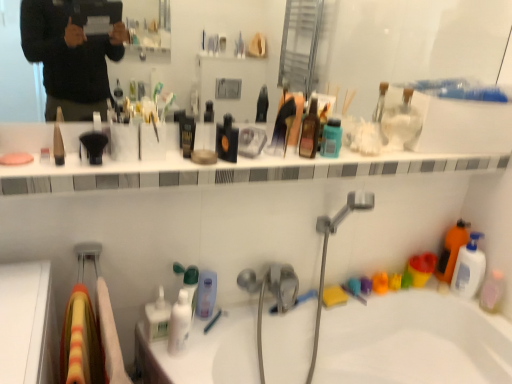
At what (x,y) coordinates should I click in order to perform the action: click on shiny brown bottle at center, acting as the 1th cleaning product starting from the top. Please return your answer as a coordinate pair (x, y). Looking at the image, I should click on (309, 131).

At what (x,y) coordinates should I click in order to perform the action: click on white glossy jar at upper center, placed as the 1th toiletry when sorted from top to bottom. Please return your answer as a coordinate pair (x, y). The height and width of the screenshot is (384, 512). Looking at the image, I should click on (400, 118).

You are a GUI agent. You are given a task and a screenshot of the screen. Output one action in this format:
    pyautogui.click(x=<x>, y=<y>)
    Task: Click on the black glass bottle at center, the 5th toiletry from the left
    
    Given the screenshot: What is the action you would take?
    pyautogui.click(x=227, y=140)

This screenshot has width=512, height=384. What do you see at coordinates (469, 268) in the screenshot? I see `white plastic mouthwash at right, arranged as the 1th mouthwash when viewed from the back` at bounding box center [469, 268].

At what (x,y) coordinates should I click in order to perform the action: click on matte black pencil at upper left, the 6th toiletry viewed from the right. Please return your answer as a coordinate pair (x, y). This screenshot has width=512, height=384. Looking at the image, I should click on (58, 140).

What do you see at coordinates (58, 140) in the screenshot?
I see `matte black pencil at upper left, marked as the 4th toiletry in a bottom-to-top arrangement` at bounding box center [58, 140].

In order to face transparent glass mirror at upper center, should I rotate leftwards or rightwards?

Turn right by 6.823 degrees to look at transparent glass mirror at upper center.

Locate an element on the screen. This screenshot has height=384, width=512. shiny brown bottle at center, which is the second cleaning product from left to right is located at coordinates (309, 131).

Does point (154, 325) lie behind point (59, 144)?

Yes, point (154, 325) is farther from viewer.

Could you tell me if white glossy pump bottle at lower center, marked as the fifth toiletry in a top-to-bottom arrangement, is turned towards matte black pencil at upper left, marked as the 4th toiletry in a bottom-to-top arrangement?

No.

Which of these two, white glossy pump bottle at lower center, the second toiletry when ordered from bottom to top, or matte black pencil at upper left, the 3th toiletry positioned from the top, is smaller?

Smaller between the two is matte black pencil at upper left, the 3th toiletry positioned from the top.

Which is more to the left, white glossy pump bottle at lower center, marked as the fifth toiletry in a top-to-bottom arrangement, or matte black pencil at upper left, the 6th toiletry viewed from the right?

From the viewer's perspective, matte black pencil at upper left, the 6th toiletry viewed from the right, appears more on the left side.

Could you tell me if black glass bottle at center, which ranks as the 2th toiletry in top-to-bottom order, is turned towards white glossy bottle at center, which is the 1th cleaning product from bottom to top?

No, black glass bottle at center, which ranks as the 2th toiletry in top-to-bottom order, is not aimed at white glossy bottle at center, which is the 1th cleaning product from bottom to top.

Which object is further away from the camera taking this photo, black glass bottle at center, which ranks as the 2th toiletry in top-to-bottom order, or white glossy bottle at center, marked as the second cleaning product in a front-to-back arrangement?

white glossy bottle at center, marked as the second cleaning product in a front-to-back arrangement, is more distant.

From a real-world perspective, is black glass bottle at center, the 5th toiletry from the left, under white glossy bottle at center, the third cleaning product when ordered from top to bottom?

No.

From the black glass bottle at center, which appears as the 2th toiletry when viewed from the right, count 2nd cleaning products backward and point to it. Please provide its 2D coordinates.

[(189, 282)]

Is white glossy pump bottle at lower center, which is the fifth toiletry from right to left, closer to the viewer compared to black glass bottle at center, the 5th toiletry from the left?

That is False.

From a real-world perspective, starting from the white glossy pump bottle at lower center, the second toiletry when ordered from bottom to top, which toiletry is the 4th one vertically above it? Please provide its 2D coordinates.

[(227, 140)]

Is white glossy pump bottle at lower center, marked as the fifth toiletry in a top-to-bottom arrangement, at the left side of black glass bottle at center, which ranks as the 5th toiletry in bottom-to-top order?

Yes.

Measure the distance from white glossy pump bottle at lower center, marked as the fifth toiletry in a top-to-bottom arrangement, to black glass bottle at center, which ranks as the 5th toiletry in bottom-to-top order.

The distance of white glossy pump bottle at lower center, marked as the fifth toiletry in a top-to-bottom arrangement, from black glass bottle at center, which ranks as the 5th toiletry in bottom-to-top order, is 21.16 inches.

Is transparent glass mirror at upper center located outside white glossy jar at upper center, placed as the 1th toiletry when sorted from top to bottom?

Yes, transparent glass mirror at upper center is outside of white glossy jar at upper center, placed as the 1th toiletry when sorted from top to bottom.

From the image's perspective, would you say transparent glass mirror at upper center is positioned over white glossy jar at upper center, which appears as the 1th toiletry when viewed from the right?

Correct, transparent glass mirror at upper center appears higher than white glossy jar at upper center, which appears as the 1th toiletry when viewed from the right, in the image.

Is transparent glass mirror at upper center shorter than white glossy jar at upper center, which ranks as the 6th toiletry in bottom-to-top order?

Incorrect, the height of transparent glass mirror at upper center does not fall short of that of white glossy jar at upper center, which ranks as the 6th toiletry in bottom-to-top order.

Does point (441, 43) appear closer or farther from the camera than point (403, 147)?

Point (441, 43) is farther from the camera than point (403, 147).

Considering the points (181, 269) and (437, 266), which point is in front, point (181, 269) or point (437, 266)?

Positioned in front is point (181, 269).

From the image's perspective, which object appears higher, white glossy bottle at center, which is the 1th cleaning product from bottom to top, or orange matte bottle at right, arranged as the second cleaning product when ordered from the bottom?

orange matte bottle at right, arranged as the second cleaning product when ordered from the bottom, from the image's perspective.

In the image, there is a orange matte bottle at right, the 3th cleaning product positioned from the left. In order to click on cleaning product below it (from the image's perspective) in this screenshot , I will do `click(189, 282)`.

Is white glossy bottle at center, the third cleaning product when ordered from top to bottom, surrounding orange matte bottle at right, placed as the 3th cleaning product when sorted from front to back?

No, orange matte bottle at right, placed as the 3th cleaning product when sorted from front to back, is not a part of white glossy bottle at center, the third cleaning product when ordered from top to bottom.

Consider the image. What's the angular difference between matte black pencil at upper left, which is counted as the 1th toiletry, starting from the left, and white plastic mouthwash at right, the 2th mouthwash in the top-to-bottom sequence,'s facing directions?

There is a 83.1-degree angle between the facing directions of matte black pencil at upper left, which is counted as the 1th toiletry, starting from the left, and white plastic mouthwash at right, the 2th mouthwash in the top-to-bottom sequence.

Visually, is matte black pencil at upper left, the 6th toiletry viewed from the right, positioned to the left or to the right of white plastic mouthwash at right, which is the second mouthwash from left to right?

In the image, matte black pencil at upper left, the 6th toiletry viewed from the right, appears on the left side of white plastic mouthwash at right, which is the second mouthwash from left to right.

Which point is more forward, (57, 163) or (472, 237)?

Point (57, 163)

Do you think white glossy bottle at center, marked as the second cleaning product in a front-to-back arrangement, is within white plastic mouthwash at right, arranged as the 1th mouthwash when viewed from the back, or outside of it?

The correct answer is: outside.

From a real-world perspective, is white glossy bottle at center, the third cleaning product when ordered from top to bottom, located beneath white plastic mouthwash at right, the 2th mouthwash in the top-to-bottom sequence?

Yes, from a real-world perspective, white glossy bottle at center, the third cleaning product when ordered from top to bottom, is under white plastic mouthwash at right, the 2th mouthwash in the top-to-bottom sequence.

In the image, is white glossy bottle at center, which is the 1th cleaning product from bottom to top, positioned in front of or behind white plastic mouthwash at right, the third mouthwash viewed from the front?

In the image, white glossy bottle at center, which is the 1th cleaning product from bottom to top, appears in front of white plastic mouthwash at right, the third mouthwash viewed from the front.

Does white glossy bottle at center, the 2th cleaning product viewed from the back, have a lesser width compared to white plastic mouthwash at right, arranged as the 1th mouthwash when viewed from the back?

No.

There is a matte black pencil at upper left, the 3th toiletry positioned from the top. Identify the location of the 2nd toiletry below it (from the image's perspective). (158, 317).

Identify the location of cleaning product that is on the left side of black glass bottle at center, which ranks as the 5th toiletry in bottom-to-top order. The width and height of the screenshot is (512, 384). (x=189, y=282).

Based on their spatial positions, is white plastic mouthwash at right, the third mouthwash viewed from the front, or white glossy pump bottle at lower center, the second toiletry in the left-to-right sequence, closer to shiny brown bottle at center, the 2th cleaning product from the right?

Among the two, white glossy pump bottle at lower center, the second toiletry in the left-to-right sequence, is located nearer to shiny brown bottle at center, the 2th cleaning product from the right.

Estimate the real-world distances between objects in this image. Which object is closer to white glossy bottle at center, the third cleaning product when ordered from top to bottom, shiny brown bottle at center, which is the second cleaning product from left to right, or white glossy jar at upper center, placed as the 1th toiletry when sorted from top to bottom?

Among the two, shiny brown bottle at center, which is the second cleaning product from left to right, is located nearer to white glossy bottle at center, the third cleaning product when ordered from top to bottom.

Consider the image. Looking at the image, which one is located closer to shiny brown bottle at center, which is the second cleaning product from left to right, white glossy jar at upper center, placed as the 1th toiletry when sorted from top to bottom, or white plastic bottle at lower center, positioned as the fourth toiletry in right-to-left order?

Based on the image, white glossy jar at upper center, placed as the 1th toiletry when sorted from top to bottom, appears to be nearer to shiny brown bottle at center, which is the second cleaning product from left to right.

Looking at this image, considering their positions, is white glossy bottle at center, which ranks as the 3th cleaning product in right-to-left order, positioned further to white glossy ledge at upper center than shiny brown bottle at center, the 3th cleaning product when ordered from bottom to top?

white glossy bottle at center, which ranks as the 3th cleaning product in right-to-left order.

Which object lies nearer to the anchor point transparent glass mirror at upper center, matte black pencil at upper left, which is counted as the 1th toiletry, starting from the left, or white plastic bottle at lower center, the third toiletry from the left?

matte black pencil at upper left, which is counted as the 1th toiletry, starting from the left, lies closer to transparent glass mirror at upper center than the other object.

Based on the photo, considering their positions, is white plastic mouthwash at right, the 2th mouthwash in the bottom-to-top sequence, positioned further to translucent plastic mouthwash at lower right, arranged as the 1th mouthwash when viewed from the right, than white glossy bottle at center, the 1th cleaning product in the left-to-right sequence?

The object further to translucent plastic mouthwash at lower right, arranged as the 1th mouthwash when viewed from the right, is white glossy bottle at center, the 1th cleaning product in the left-to-right sequence.

Estimate the real-world distances between objects in this image. Which object is further from white glossy jar at upper center, which is the 6th toiletry in left-to-right order, white plastic bottle at lower center, positioned as the fourth toiletry in right-to-left order, or translucent plastic mouthwash at lower right, which is counted as the third mouthwash, starting from the top?

white plastic bottle at lower center, positioned as the fourth toiletry in right-to-left order.

Which object lies nearer to the anchor point white glossy jar at upper center, which appears as the 1th toiletry when viewed from the right, matte black pencil at upper left, the 3th toiletry positioned from the top, or white glossy pump bottle at lower center, the second toiletry when ordered from bottom to top?

white glossy pump bottle at lower center, the second toiletry when ordered from bottom to top, is positioned closer to the anchor white glossy jar at upper center, which appears as the 1th toiletry when viewed from the right.

What are the coordinates of `toiletry situated between black glass bottle at center, the 5th toiletry from the left, and orange matte bottle at right, placed as the 3th cleaning product when sorted from front to back, from left to right` in the screenshot? It's located at click(x=400, y=118).

Find the location of a particular element. The image size is (512, 384). mouthwash located between matte black pencil at upper left, the 3th toiletry positioned from the top, and white plastic mouthwash at right, the 2th mouthwash in the bottom-to-top sequence, in the left-right direction is located at coordinates (331, 138).

In order to click on ledge between white glossy bottle at center, the 1th cleaning product in the left-to-right sequence, and translucent plastic mouthwash at lower right, the 1th mouthwash in the bottom-to-top sequence, in the horizontal direction in this screenshot , I will do pos(219,169).

Identify the location of mirror situated between white plastic bottle at lower center, which ranks as the 1th toiletry in bottom-to-top order, and orange matte bottle at right, placed as the 3th cleaning product when sorted from front to back, from left to right. This screenshot has height=384, width=512. (409, 43).